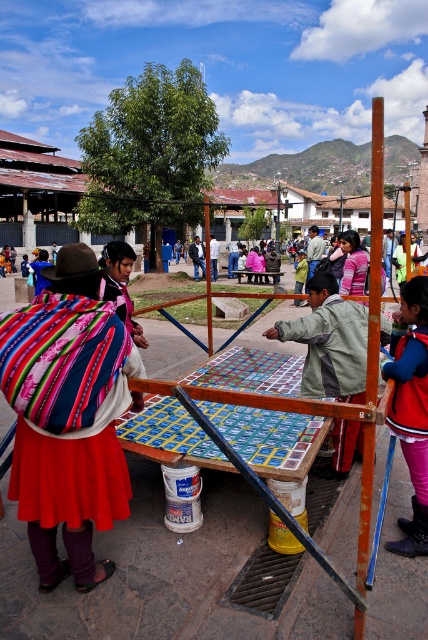
Which of these two, multicolored woven fabric at center or matte pink sweater at center, stands shorter?

matte pink sweater at center

Who is more distant from viewer, (80, 540) or (353, 266)?

The point (353, 266) is more distant.

Does point (44, 456) come closer to viewer compared to point (344, 278)?

That is True.

At what (x,y) coordinates should I click in order to perform the action: click on multicolored woven fabric at center. Please return your answer as a coordinate pair (x, y). Looking at the image, I should click on (74, 435).

Which is more to the right, green fabric jacket at center or velvet red coat at lower right?

From the viewer's perspective, velvet red coat at lower right appears more on the right side.

Does green fabric jacket at center have a larger size compared to velvet red coat at lower right?

Correct, green fabric jacket at center is larger in size than velvet red coat at lower right.

Describe the element at coordinates (329, 342) in the screenshot. I see `green fabric jacket at center` at that location.

I want to click on green fabric jacket at center, so click(329, 342).

Which is behind, point (58, 285) or point (350, 381)?

Positioned behind is point (350, 381).

Who is positioned more to the right, multicolored woven fabric at center or green fabric jacket at center?

From the viewer's perspective, green fabric jacket at center appears more on the right side.

Does point (62, 264) lie in front of point (344, 372)?

That is True.

Find the location of a particular element. multicolored woven fabric at center is located at coordinates (74, 435).